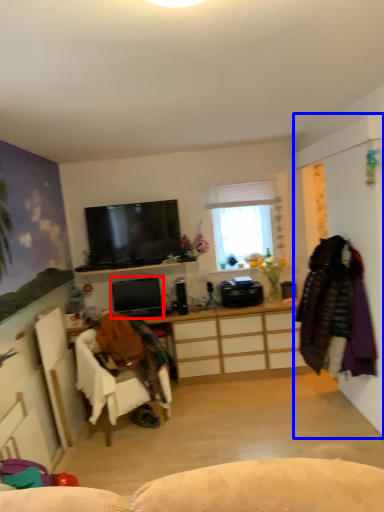
Question: Which object is closer to the camera taking this photo, television (highlighted by a red box) or side (highlighted by a blue box)?

Choices:
 (A) television
 (B) side

Answer: (B)